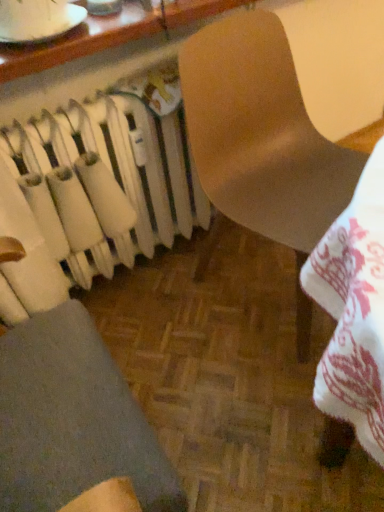
Locate an element on the screen. The width and height of the screenshot is (384, 512). blank area to the left of matte brown chair at center is located at coordinates (175, 324).